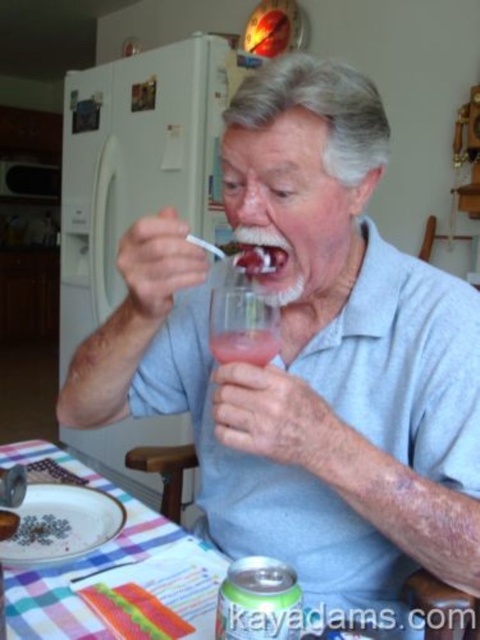
Between point (222, 586) and point (274, 332), which one is positioned behind?

Point (274, 332)

The width and height of the screenshot is (480, 640). Describe the element at coordinates (259, 602) in the screenshot. I see `green metallic can at lower center` at that location.

Is point (254, 625) positioned in front of point (228, 340)?

Yes, point (254, 625) is in front of point (228, 340).

Where is `green metallic can at lower center`? green metallic can at lower center is located at coordinates point(259,602).

Does green metallic can at lower center have a larger size compared to smooth red jelly at mouth?

Indeed, green metallic can at lower center has a larger size compared to smooth red jelly at mouth.

How far apart are green metallic can at lower center and smooth red jelly at mouth?

green metallic can at lower center and smooth red jelly at mouth are 37.78 centimeters apart.

Which is behind, point (260, 563) or point (261, 273)?

Positioned behind is point (261, 273).

The height and width of the screenshot is (640, 480). I want to click on green metallic can at lower center, so click(x=259, y=602).

Between point (240, 340) and point (249, 273), which one is positioned in front?

Point (240, 340) is more forward.

Is translucent glass at lower center positioned before smooth red jelly at mouth?

Yes, it is.

Locate an element on the screen. Image resolution: width=480 pixels, height=640 pixels. translucent glass at lower center is located at coordinates (244, 346).

Locate an element on the screen. This screenshot has width=480, height=640. translucent glass at lower center is located at coordinates (244, 346).